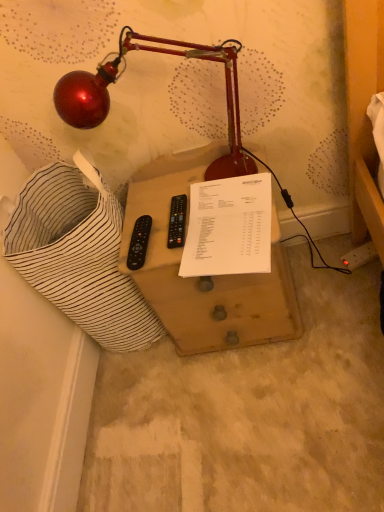
Question: From a real-world perspective, is white paper at center physically located above or below black plastic remote at center-left, arranged as the second control when viewed from the right?

Choices:
 (A) below
 (B) above

Answer: (A)

Question: Is white paper at center taller or shorter than black plastic remote at center-left, the first control in the left-to-right sequence?

Choices:
 (A) tall
 (B) short

Answer: (A)

Question: Which object is positioned farthest from the black plastic remote at center, marked as the 1th control in a right-to-left arrangement?

Choices:
 (A) white paper at center
 (B) metallic red lamp at upper left
 (C) black plastic remote at center-left, arranged as the second control when viewed from the right
 (D) wooden drawer at center

Answer: (B)

Question: Considering the real-world distances, which object is farthest from the black plastic remote at center, marked as the 1th control in a right-to-left arrangement?

Choices:
 (A) wooden drawer at center
 (B) white paper at center
 (C) black plastic remote at center-left, arranged as the second control when viewed from the right
 (D) metallic red lamp at upper left

Answer: (D)